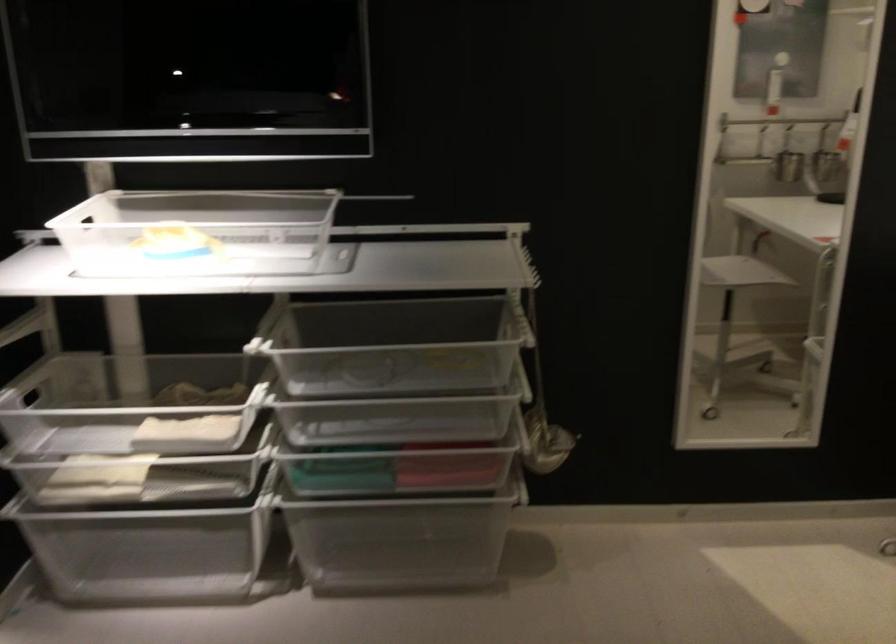
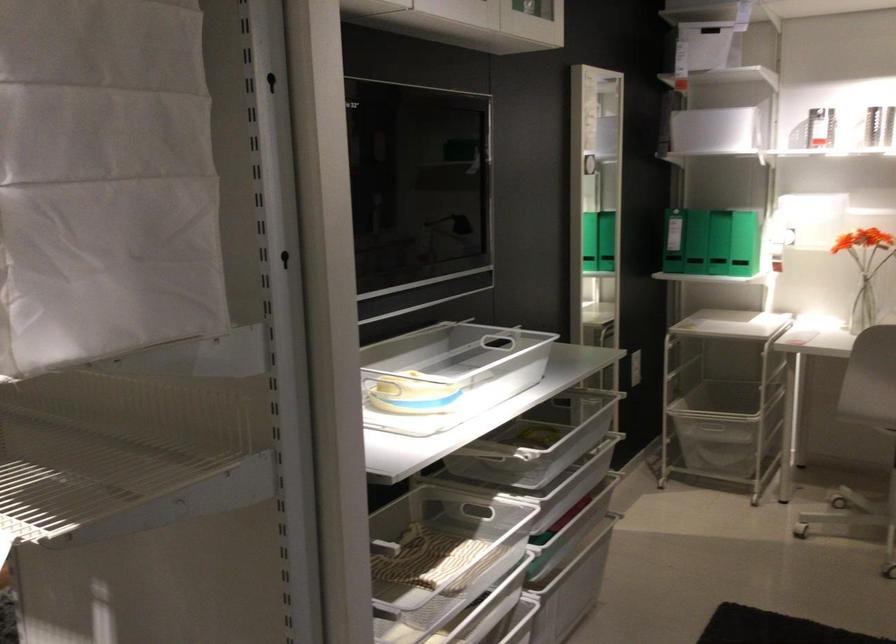
Question: I am providing you with two images of the same scene from different viewpoints. After the viewpoint changes to image2, which objects are now occluded?

Choices:
 (A) chair sitting surface
 (B) brown cabinet handle
 (C) white bin handle
 (D) plastic drawer handle

Answer: (A)